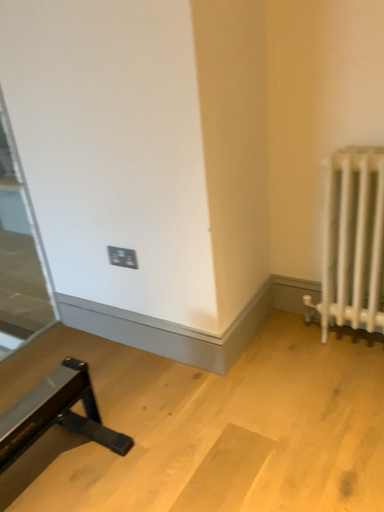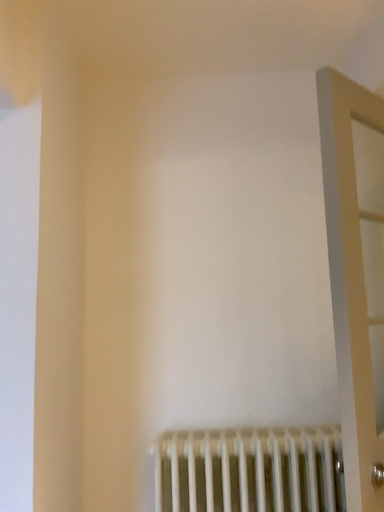
Question: Which way did the camera rotate in the video?

Choices:
 (A) rotated right
 (B) rotated left

Answer: (A)